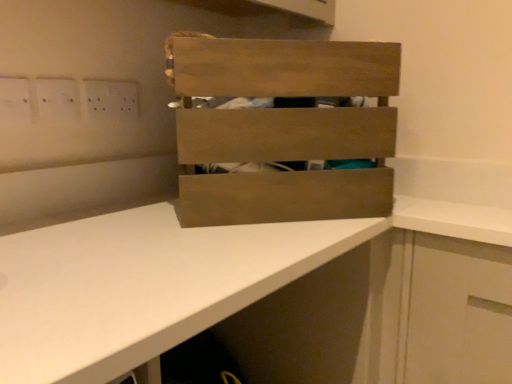
Describe the element at coordinates (285, 129) in the screenshot. I see `wooden crate at center` at that location.

Where is `white matte countertop at center`? This screenshot has width=512, height=384. white matte countertop at center is located at coordinates (213, 254).

Is wooden crate at center surrounding white matte countertop at center?

That's incorrect, white matte countertop at center is not inside wooden crate at center.

Considering the sizes of objects wooden crate at center and white matte countertop at center in the image provided, who is wider, wooden crate at center or white matte countertop at center?

Wider between the two is white matte countertop at center.

From the image's perspective, is wooden crate at center under white matte countertop at center?

No.

Is wooden crate at center placed right next to white matte countertop at center?

wooden crate at center and white matte countertop at center are clearly separated.

Which of these two, white plastic electric outlet at upper left or wooden crate at center, is smaller?

white plastic electric outlet at upper left.

Is white plastic electric outlet at upper left positioned with its back to wooden crate at center?

No, white plastic electric outlet at upper left is not facing the opposite direction of wooden crate at center.

Is white plastic electric outlet at upper left beside wooden crate at center?

No, white plastic electric outlet at upper left is not making contact with wooden crate at center.

Can you tell me how much white plastic electric outlet at upper left and wooden crate at center differ in facing direction?

41.7 degrees separate the facing orientations of white plastic electric outlet at upper left and wooden crate at center.

Can you confirm if wooden crate at center is positioned to the right of white plastic electric outlet at upper left?

Yes, wooden crate at center is to the right of white plastic electric outlet at upper left.

Based on the photo, can you confirm if wooden crate at center is wider than white plastic electric outlet at upper left?

Correct, the width of wooden crate at center exceeds that of white plastic electric outlet at upper left.

Between point (389, 140) and point (117, 97), which one is positioned in front?

The point (389, 140) is in front.

Does white matte countertop at center have a lesser width compared to white plastic electric outlet at upper left?

Incorrect, the width of white matte countertop at center is not less than that of white plastic electric outlet at upper left.

Does white matte countertop at center appear on the right side of white plastic electric outlet at upper left?

Correct, you'll find white matte countertop at center to the right of white plastic electric outlet at upper left.

Does point (156, 240) lie behind point (118, 108)?

No, it is in front of (118, 108).

From a real-world perspective, is white matte countertop at center physically located above or below white plastic electric outlet at upper left?

white matte countertop at center is situated lower than white plastic electric outlet at upper left in the real world.

Would you say white matte countertop at center is outside wooden crate at center?

Yes.

Would you say white matte countertop at center is a long distance from wooden crate at center?

white matte countertop at center is actually quite close to wooden crate at center.

Considering the relative positions of white matte countertop at center and wooden crate at center in the image provided, is white matte countertop at center to the right of wooden crate at center from the viewer's perspective?

In fact, white matte countertop at center is to the left of wooden crate at center.

Can you tell me how much white matte countertop at center and wooden crate at center differ in facing direction?

The angular difference between white matte countertop at center and wooden crate at center is 40.6 degrees.

Would you say white plastic electric outlet at upper left is to the left or to the right of white matte countertop at center in the picture?

Clearly, white plastic electric outlet at upper left is on the left of white matte countertop at center in the image.

Is the depth of white plastic electric outlet at upper left less than that of white matte countertop at center?

No, it is not.

From a real-world perspective, which object stands above the other?

white plastic electric outlet at upper left.

How distant is white plastic electric outlet at upper left from white matte countertop at center?

white plastic electric outlet at upper left and white matte countertop at center are 52.63 centimeters apart from each other.

Find the location of a particular element. The image size is (512, 384). countertop located on the left of wooden crate at center is located at coordinates (213, 254).

This screenshot has width=512, height=384. Find the location of `crate directly beneath the white plastic electric outlet at upper left (from a real-world perspective)`. crate directly beneath the white plastic electric outlet at upper left (from a real-world perspective) is located at coordinates (x=285, y=129).

From the picture: Looking at the image, which one is located further to white matte countertop at center, white plastic electric outlet at upper left or wooden crate at center?

white plastic electric outlet at upper left lies further to white matte countertop at center than the other object.

From the image, which object appears to be farther from wooden crate at center, white matte countertop at center or white plastic electric outlet at upper left?

white plastic electric outlet at upper left lies further to wooden crate at center than the other object.

In the scene shown: Which object lies nearer to the anchor point white matte countertop at center, wooden crate at center or white plastic electric outlet at upper left?

wooden crate at center.

In the scene shown: From the image, which object appears to be nearer to white plastic electric outlet at upper left, white matte countertop at center or wooden crate at center?

wooden crate at center lies closer to white plastic electric outlet at upper left than the other object.

Based on their spatial positions, is white plastic electric outlet at upper left or white matte countertop at center closer to wooden crate at center?

white matte countertop at center is closer to wooden crate at center.

Estimate the real-world distances between objects in this image. Which object is closer to white plastic electric outlet at upper left, wooden crate at center or white matte countertop at center?

The object closer to white plastic electric outlet at upper left is wooden crate at center.

You are a GUI agent. You are given a task and a screenshot of the screen. Output one action in this format:
    pyautogui.click(x=<x>, y=<y>)
    Task: Click on the crate between white plastic electric outlet at upper left and white matte countertop at center vertically
    This screenshot has width=512, height=384.
    Given the screenshot: What is the action you would take?
    pyautogui.click(x=285, y=129)